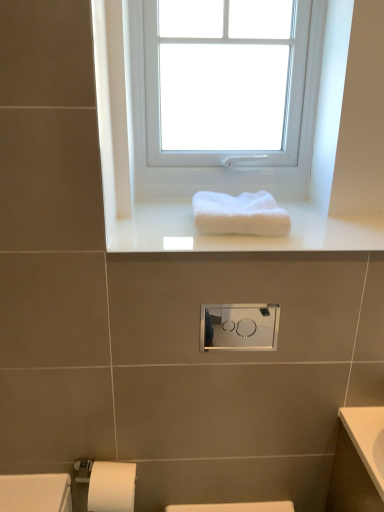
You are a GUI agent. You are given a task and a screenshot of the screen. Output one action in this format:
    pyautogui.click(x=<x>, y=<y>)
    Task: Click on the vacant space in front of white fluffy towel at center
    This screenshot has width=384, height=512.
    Given the screenshot: What is the action you would take?
    pyautogui.click(x=237, y=246)